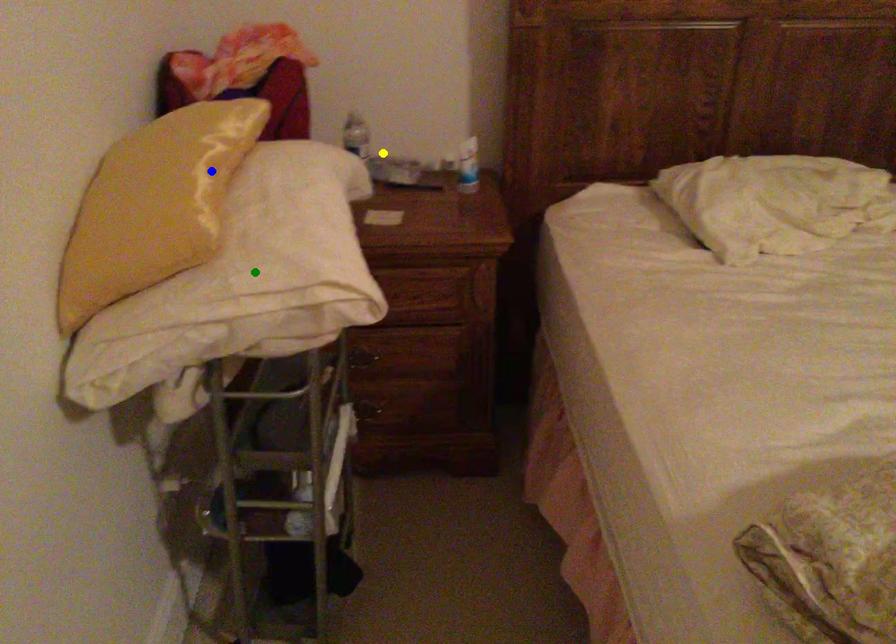
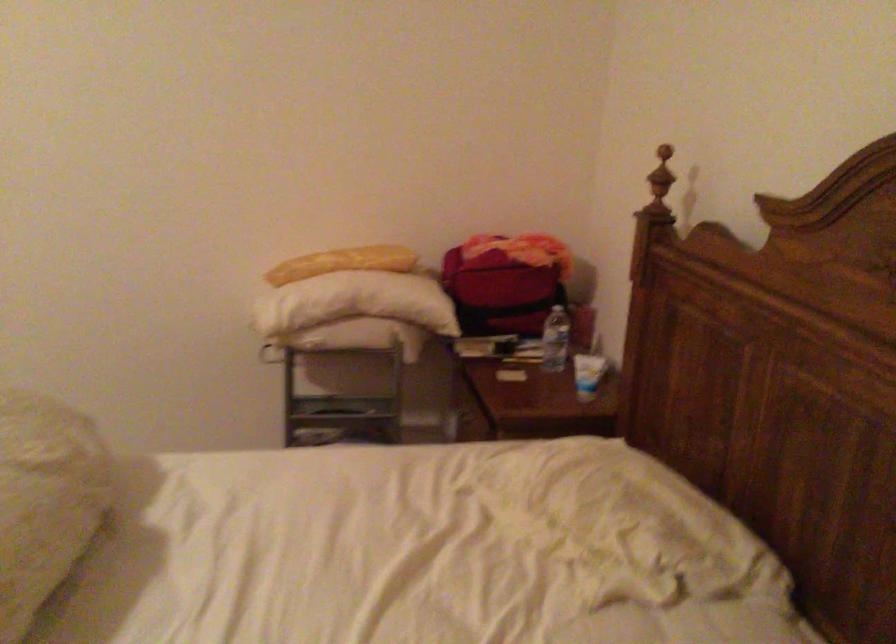
I am providing you with two images of the same scene from different viewpoints. Three points are marked in image1. Which point corresponds to a part or object that is occluded in image2?In image1, three points are marked. Which of them correspond to a part or object that is occluded in image2?Among the three points shown in image1, which one corresponds to a part or object that is no longer visible due to occlusion in image2?

green point